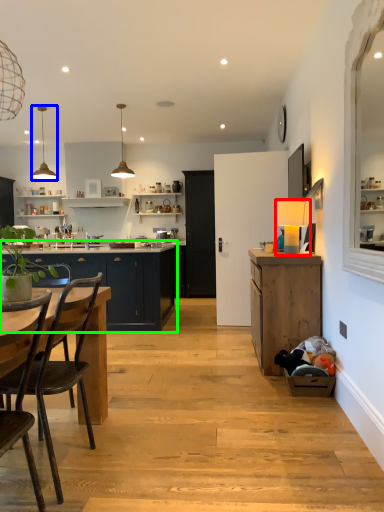
Question: Which object is positioned closest to lamp (highlighted by a red box)? Select from lamp (highlighted by a blue box) and cabinetry (highlighted by a green box).

Choices:
 (A) lamp
 (B) cabinetry

Answer: (B)